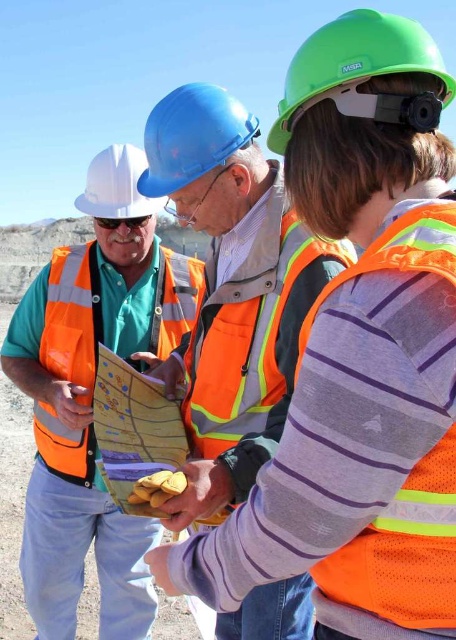
Who is more forward, [138,625] or [201,97]?

Point [201,97] is in front.

Who is more forward, (114, 300) or (206, 104)?

Point (206, 104) is in front.

Image resolution: width=456 pixels, height=640 pixels. Identify the location of orange reflective vest at left. (92, 397).

Does point (105, 168) come closer to viewer compared to point (77, 204)?

No, (105, 168) is behind (77, 204).

I want to click on orange reflective vest at left, so click(x=92, y=397).

Identify the location of orange reflective vest at left. (92, 397).

How distant is green matte helmet at upper right from blue hard hat at center?

green matte helmet at upper right is 5.48 meters from blue hard hat at center.

Measure the distance between green matte helmet at upper right and blue hard hat at center.

5.48 meters

Which is in front, point (357, 65) or point (160, 132)?

Point (357, 65) is more forward.

Where is `green matte helmet at upper right`? green matte helmet at upper right is located at coordinates (356, 60).